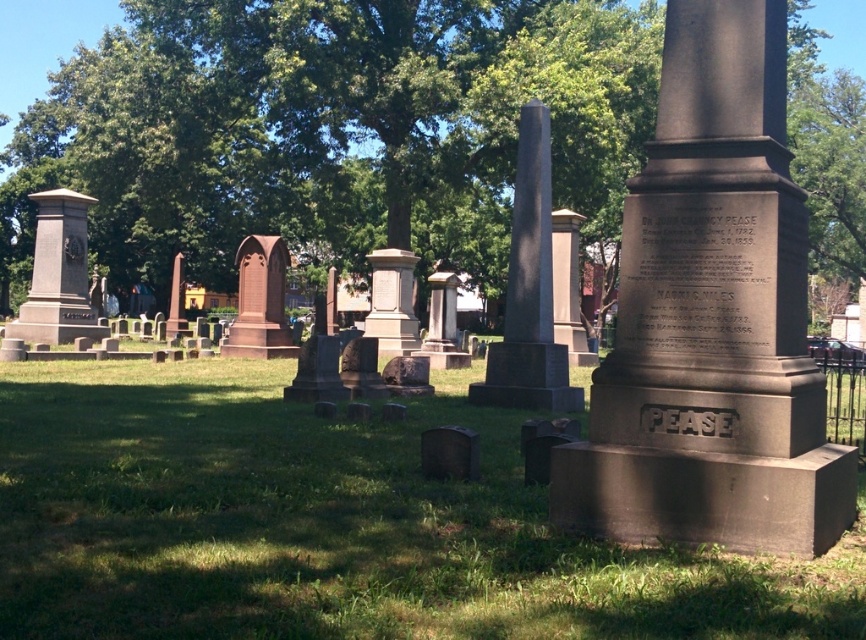
Which of these two, gray stone obelisk at center or brown stone monument at center, stands shorter?

brown stone monument at center

Is gray stone obelisk at center in front of brown stone monument at center?

Yes.

Describe the element at coordinates (528, 289) in the screenshot. I see `gray stone obelisk at center` at that location.

Find the location of a particular element. gray stone obelisk at center is located at coordinates (528, 289).

Which of these two, dark brown stone monument at center or brown stone monument at center, stands shorter?

brown stone monument at center is shorter.

Who is more forward, (708,285) or (295,349)?

Point (708,285)

The width and height of the screenshot is (866, 640). What do you see at coordinates (711, 320) in the screenshot?
I see `dark brown stone monument at center` at bounding box center [711, 320].

Locate an element on the screen. The width and height of the screenshot is (866, 640). dark brown stone monument at center is located at coordinates (711, 320).

Is green leafy tree at upper center taller than brown stone monument at center?

Yes, green leafy tree at upper center is taller than brown stone monument at center.

Which is behind, point (210, 52) or point (234, 321)?

The point (210, 52) is behind.

At what (x,y) coordinates should I click in order to perform the action: click on green leafy tree at upper center. Please return your answer as a coordinate pair (x, y). The image size is (866, 640). Looking at the image, I should click on (333, 131).

Locate an element on the screen. green leafy tree at upper center is located at coordinates (333, 131).